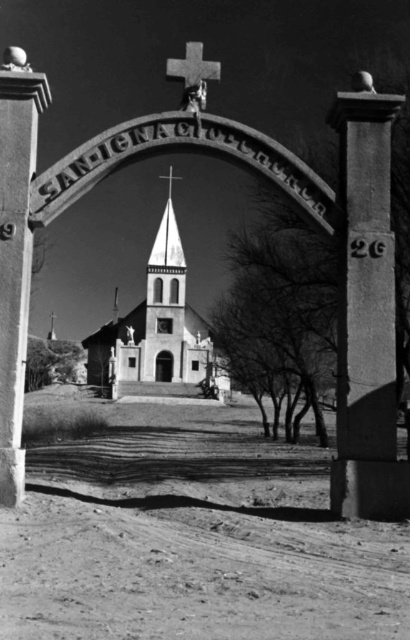
Consider the image. You are standing at the entrance of the church and want to place a new flower arrangement. The flower arrangement needs to be placed below the smooth stone cross at upper center but above the metallic cross at center. Is there enough space between them to place the flowers?

The smooth stone cross at upper center is positioned over the metallic cross at center, so there is space between them to place the flower arrangement below the smooth stone cross at upper center but above the metallic cross at center.

You are standing in front of the church entrance and want to touch both points marked on the pillars. Which point should you reach for first, the point at coordinates point [159,266] or the point at coordinates point [168,189]?

You should reach for the point at coordinates point [159,266] first because it is closer to you than the point at coordinates point [168,189].